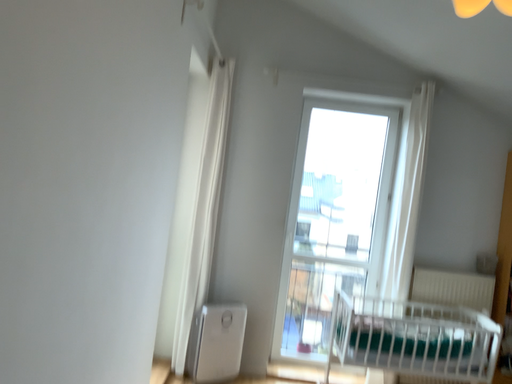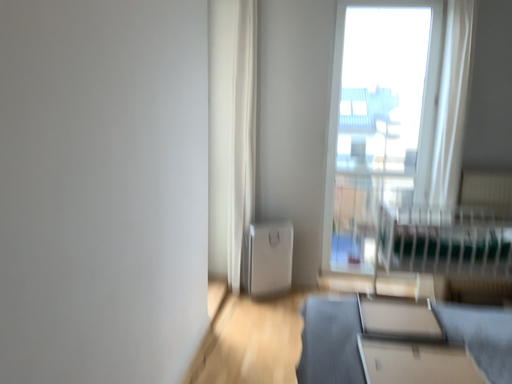
Question: Which way did the camera rotate in the video?

Choices:
 (A) rotated left
 (B) rotated right

Answer: (A)